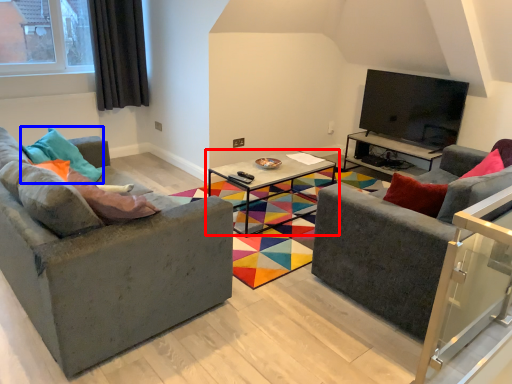
Question: Which of the following is the closest to the observer, coffee table (highlighted by a red box) or pillow (highlighted by a blue box)?

Choices:
 (A) coffee table
 (B) pillow

Answer: (B)